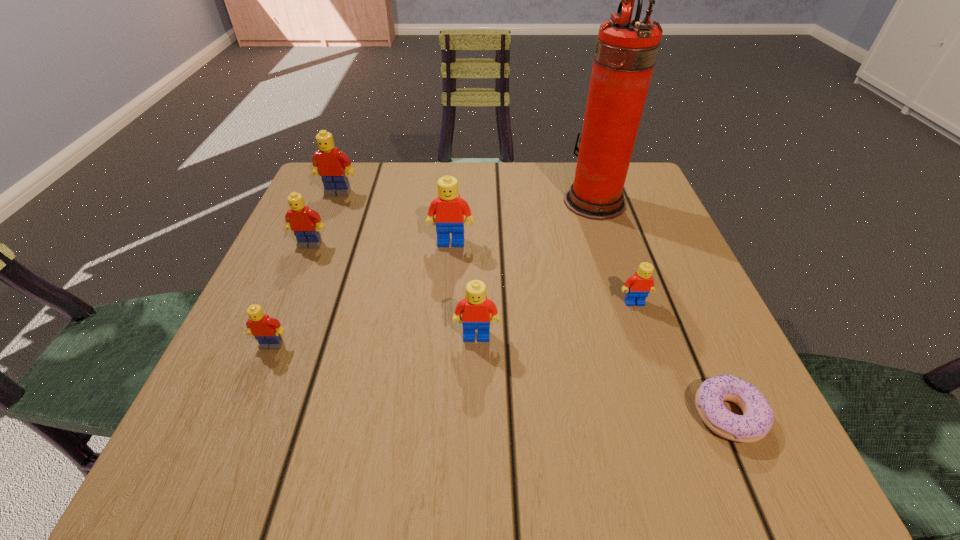
Find the location of a particular element. Image resolution: width=960 pixels, height=540 pixels. vacant area that lies between the nearest yellow Lego and the farthest Lego is located at coordinates [305, 269].

Where is `vacant space that is in between the nearest yellow Lego and the second nearest red Lego`? Image resolution: width=960 pixels, height=540 pixels. vacant space that is in between the nearest yellow Lego and the second nearest red Lego is located at coordinates (453, 323).

Find the location of a particular element. free spot between the smallest yellow Lego and the biggest yellow Lego is located at coordinates (305, 269).

Where is `free spot between the farthest yellow Lego and the nearest red Lego`? free spot between the farthest yellow Lego and the nearest red Lego is located at coordinates (407, 265).

Locate an element on the screen. The width and height of the screenshot is (960, 540). free space between the biggest red Lego and the shortest object is located at coordinates (589, 329).

I want to click on object that can be found as the fourth closest to the shortest object, so tap(449, 208).

The height and width of the screenshot is (540, 960). Identify the location of object that can be found as the third closest to the farthest Lego. (266, 330).

Point out which Lego is positioned as the second nearest to the tallest object. Please provide its 2D coordinates. Your answer should be formatted as a tuple, i.e. [(x, y)], where the tuple contains the x and y coordinates of a point satisfying the conditions above.

[(638, 286)]

Identify the location of Lego that is the fifth nearest to the nearest red Lego. (329, 163).

Identify which yellow Lego is the nearest to the farthest yellow Lego. Please provide its 2D coordinates. Your answer should be formatted as a tuple, i.e. [(x, y)], where the tuple contains the x and y coordinates of a point satisfying the conditions above.

[(301, 219)]